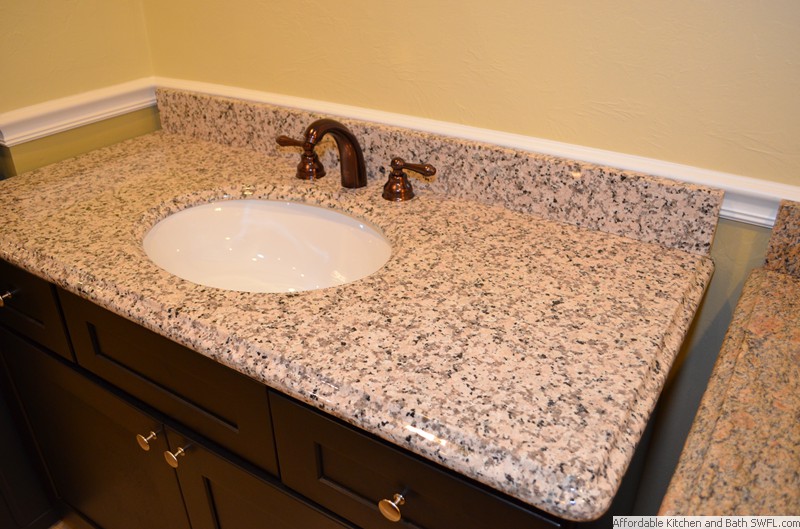
The image size is (800, 529). Identify the location of sink. (278, 247).